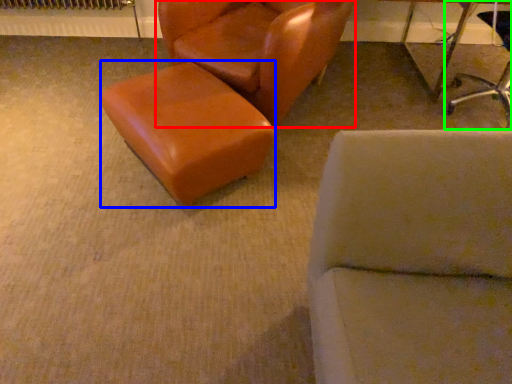
Question: Which object is the closest to the chair (highlighted by a red box)? Choose among these: stool (highlighted by a blue box) or chair (highlighted by a green box).

Choices:
 (A) stool
 (B) chair

Answer: (A)